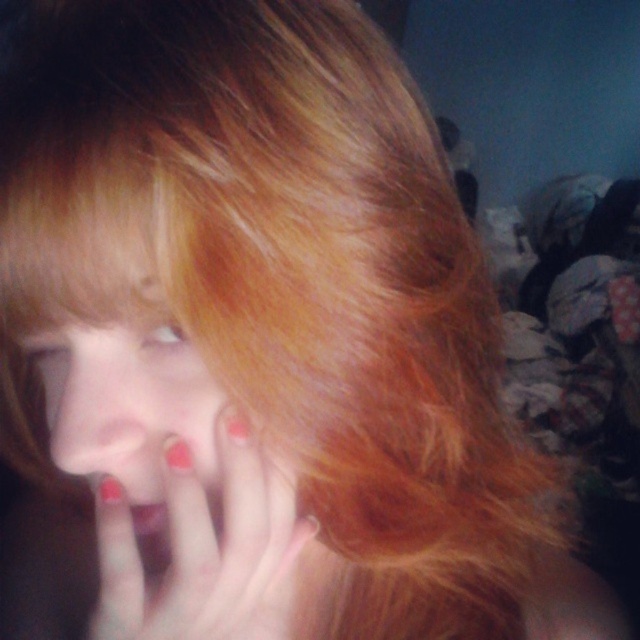
You are a photographer adjusting your camera settings to capture the details of the glossy nail polish at center and the matte red nails at center. Which object will appear closer to the camera in the final photo?

The glossy nail polish at center will appear closer to the camera because it is positioned further to the viewer than the matte red nails at center.

You are an artist preparing to paint a portrait of the person in the image. You notice the glossy nail polish at center and the matte red nails at center. Which object is located below the other?

The glossy nail polish at center is positioned under matte red nails at center, so it is located below the matte red nails at center.